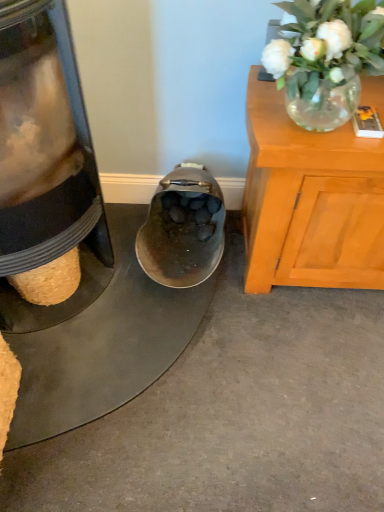
I want to click on vacant space situated above metallic bowl at center (from a real-world perspective), so coord(119,328).